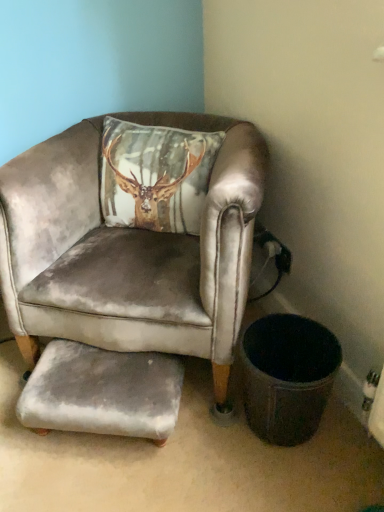
At what (x,y) coordinates should I click in order to perform the action: click on vacant area that lies in front of gray velvety footrest at lower center. Please return your answer as a coordinate pair (x, y). Looking at the image, I should click on (106, 482).